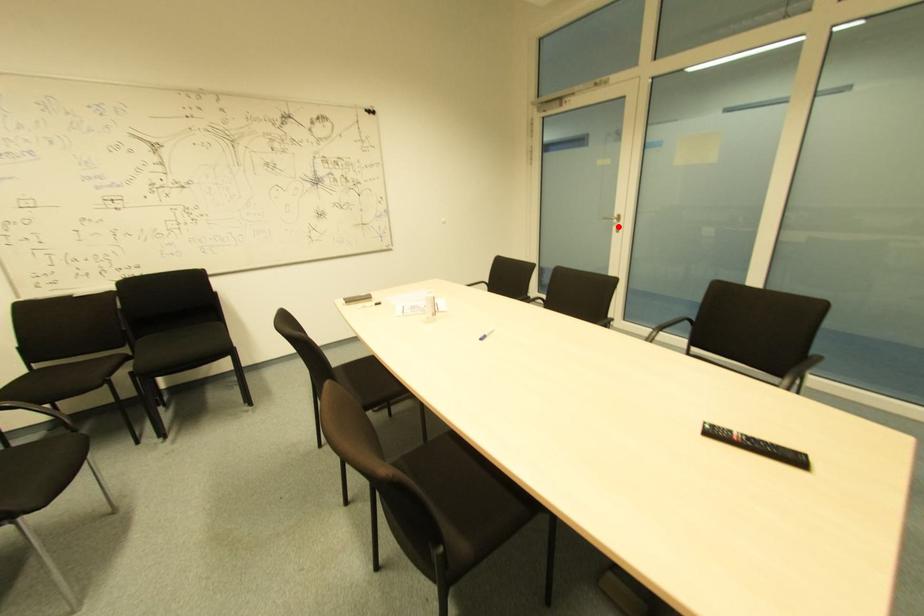
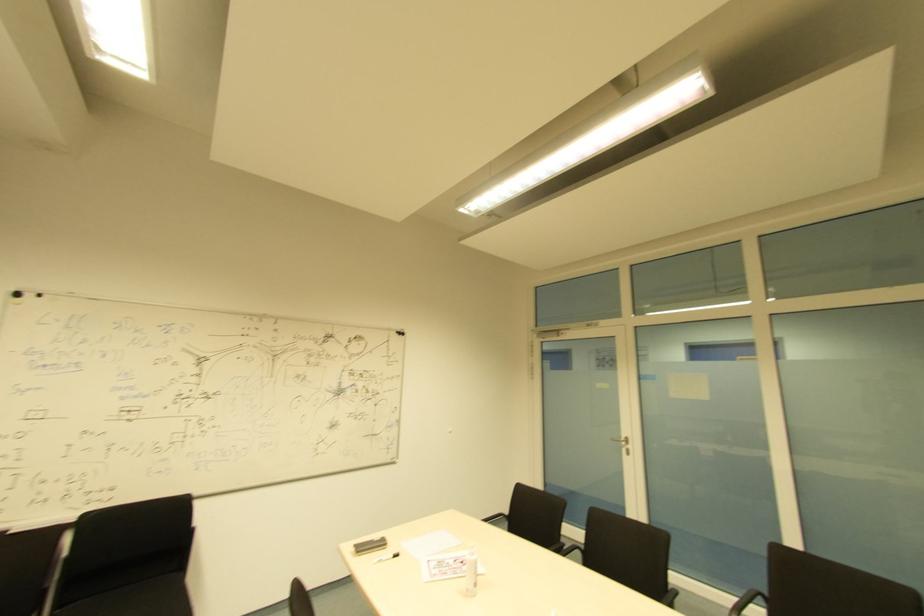
The point at the highlighted location is marked in the first image. Where is the corresponding point in the second image?

(628, 450)